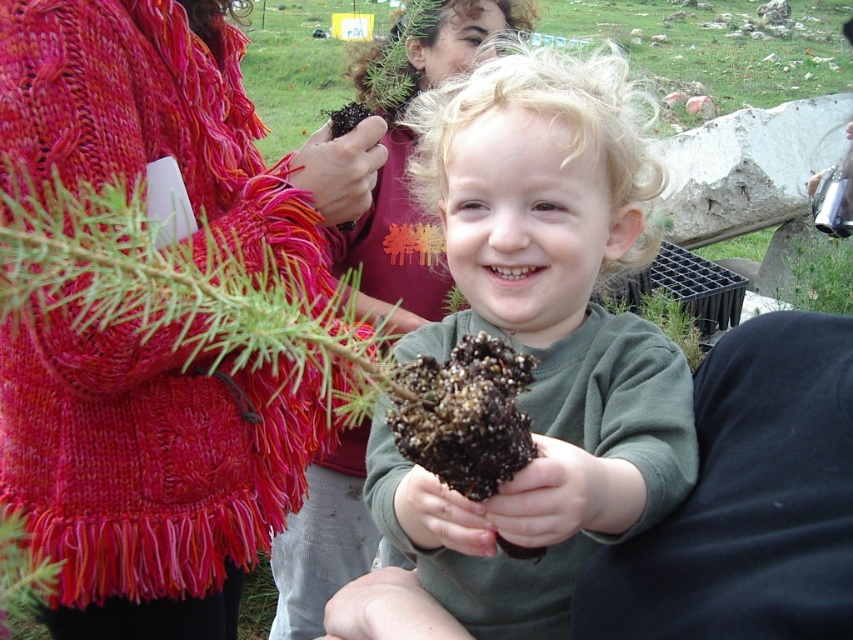
You are standing in the garden and want to find the matte green sweater at center. What are the coordinates where you should look?

The matte green sweater at center is located at coordinates point (540, 337).

Please look at the image and find the object located at point (x=540, y=337). What is it?

The object at point (x=540, y=337) is the matte green sweater at center.